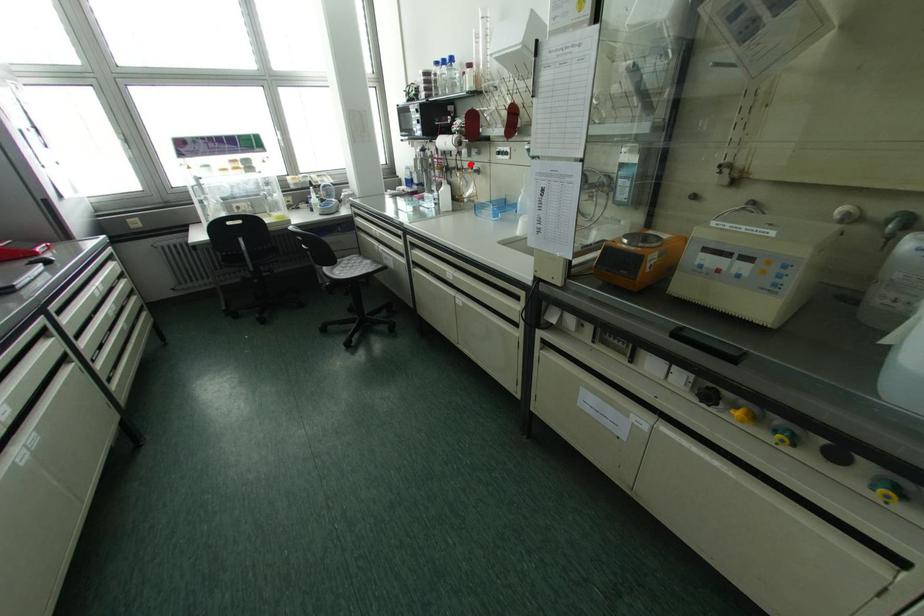
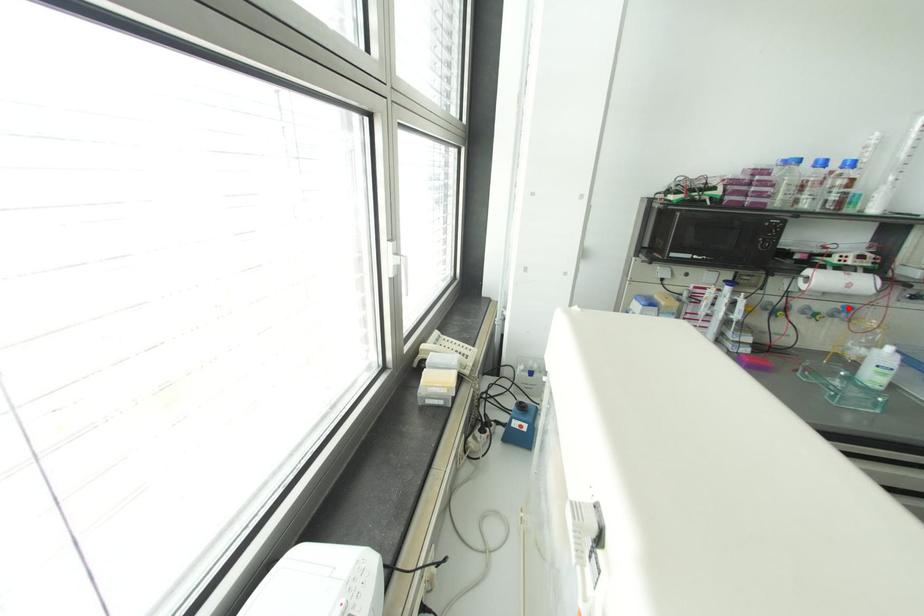
I am providing you with two images of the same scene from different viewpoints. A red point is marked on the first image and another point is marked on the second image. Are the points marked in image1 and image2 representing the same 3D position?

Yes